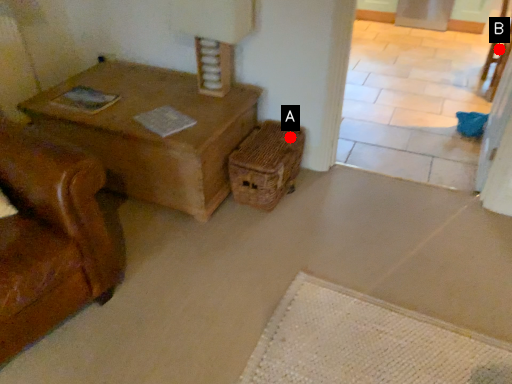
Question: Two points are circled on the image, labeled by A and B beside each circle. Which point appears farthest from the camera in this image?

Choices:
 (A) A is further
 (B) B is further

Answer: (B)